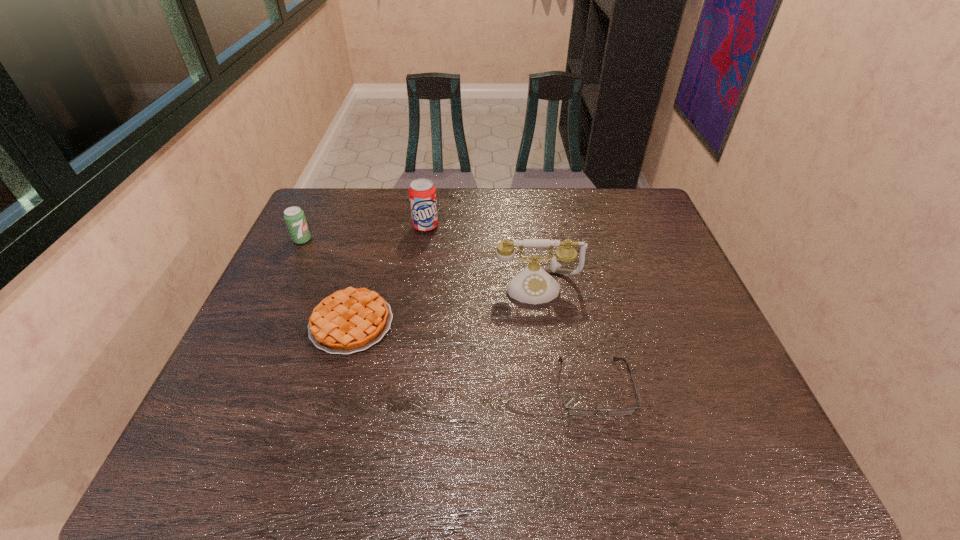
Image resolution: width=960 pixels, height=540 pixels. What are the coordinates of `vacant position at the near right corner of the desktop` in the screenshot? It's located at (762, 462).

This screenshot has height=540, width=960. Identify the location of empty location between the pie and the right soda. (389, 275).

Locate an element on the screen. This screenshot has width=960, height=540. unoccupied area between the telephone and the pie is located at coordinates (444, 305).

In order to click on free space between the nearest object and the telephone in this screenshot , I will do `click(565, 337)`.

The image size is (960, 540). What are the coordinates of `blank region between the telephone and the left soda` in the screenshot? It's located at (420, 263).

Where is `free space between the third tallest object and the fourth object from right to left`? The width and height of the screenshot is (960, 540). free space between the third tallest object and the fourth object from right to left is located at coordinates (326, 281).

You are a GUI agent. You are given a task and a screenshot of the screen. Output one action in this format:
    pyautogui.click(x=<x>, y=<y>)
    Task: Click on the vacant point located between the pie and the telephone
    The image size is (960, 540).
    Given the screenshot: What is the action you would take?
    pyautogui.click(x=444, y=305)

The height and width of the screenshot is (540, 960). I want to click on unoccupied position between the third object from left to right and the telephone, so click(482, 256).

You are a GUI agent. You are given a task and a screenshot of the screen. Output one action in this format:
    pyautogui.click(x=<x>, y=<y>)
    Task: Click on the free space between the farthest object and the nearest object
    Image resolution: width=960 pixels, height=540 pixels.
    Given the screenshot: What is the action you would take?
    pyautogui.click(x=510, y=307)

Find the location of `empty space that is in between the pie and the telephone`. empty space that is in between the pie and the telephone is located at coordinates (444, 305).